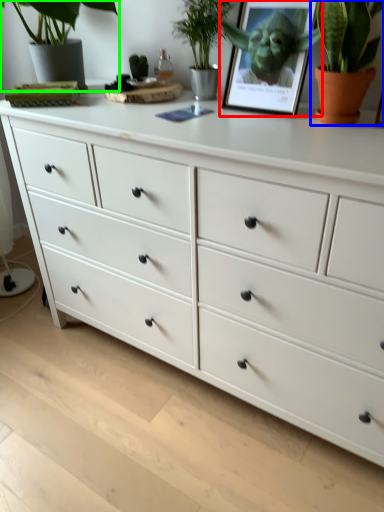
Question: Estimate the real-world distances between objects in this image. Which object is farther from picture frame (highlighted by a red box), houseplant (highlighted by a blue box) or houseplant (highlighted by a green box)?

Choices:
 (A) houseplant
 (B) houseplant

Answer: (B)